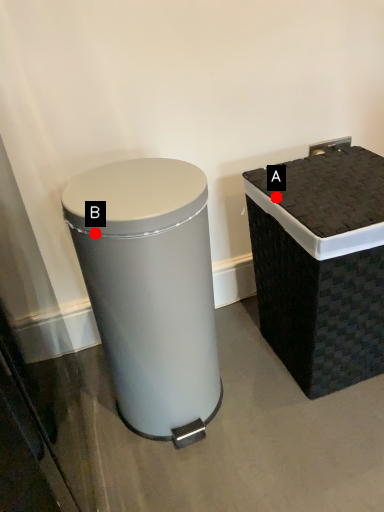
Question: Two points are circled on the image, labeled by A and B beside each circle. Which point is further to the camera?

Choices:
 (A) A is further
 (B) B is further

Answer: (A)